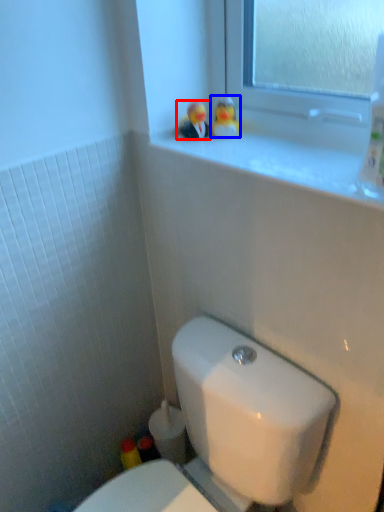
Question: Which object is further to the camera taking this photo, miniature (highlighted by a red box) or miniature (highlighted by a blue box)?

Choices:
 (A) miniature
 (B) miniature

Answer: (B)